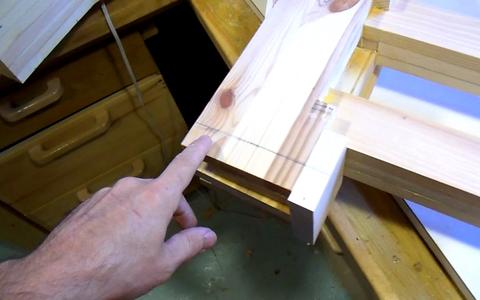
Find the location of a particular element. This screenshot has width=480, height=300. drawers is located at coordinates (95, 79), (124, 129), (148, 160).